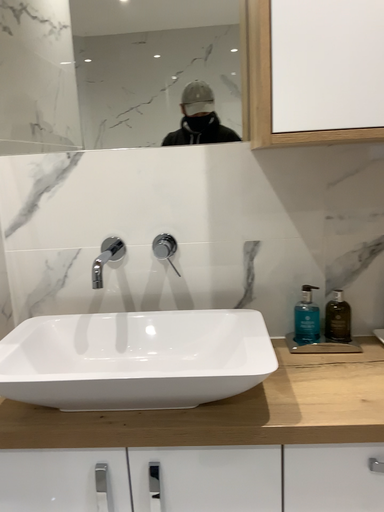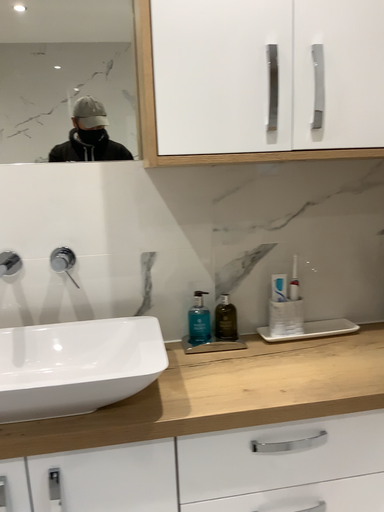
Question: How did the camera likely rotate when shooting the video?

Choices:
 (A) rotated left
 (B) rotated right

Answer: (B)